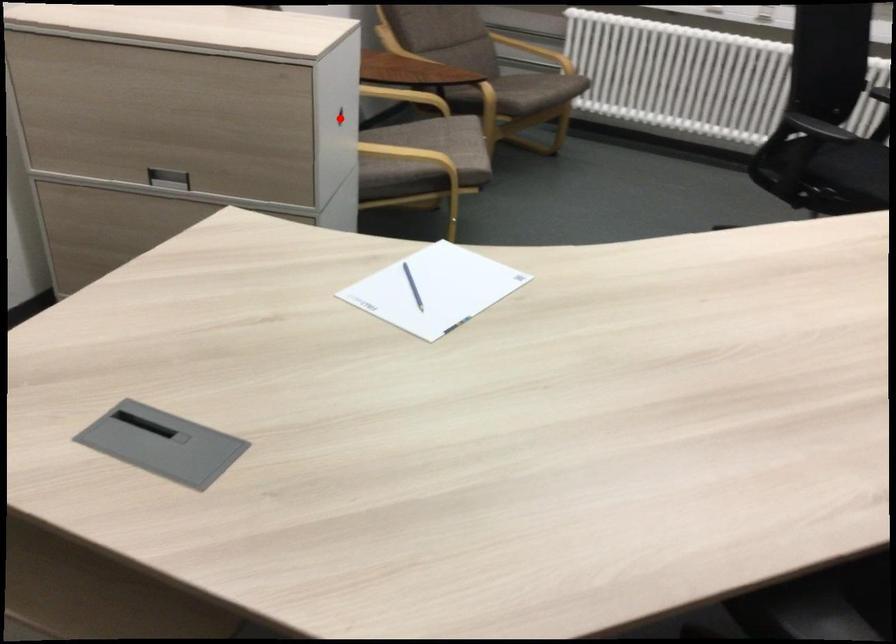
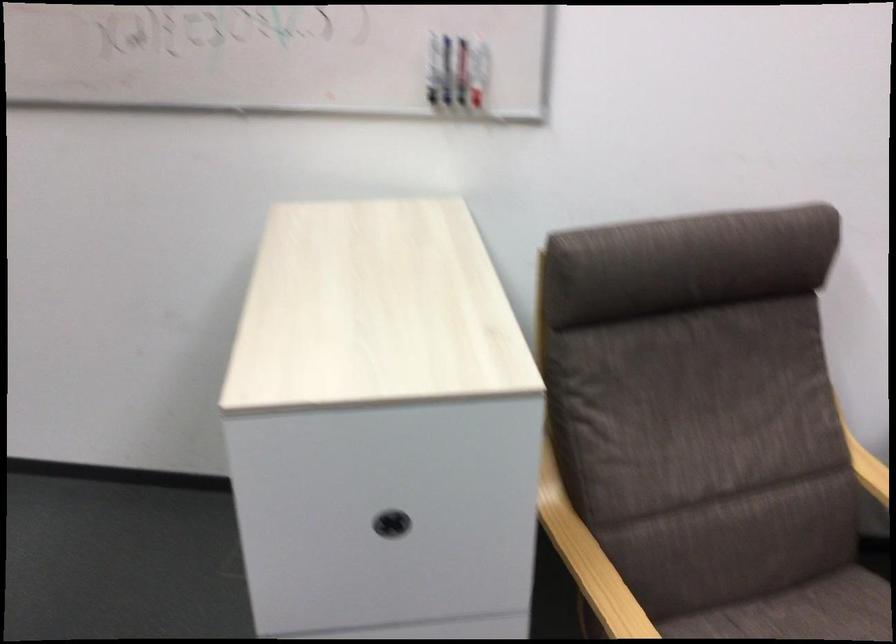
Question: A red point is marked in image1. In image2, is the corresponding 3D point closer to the camera or farther? Reply with the corresponding letter.

Choices:
 (A) The corresponding 3D point is closer.
 (B) The corresponding 3D point is farther.

Answer: (A)